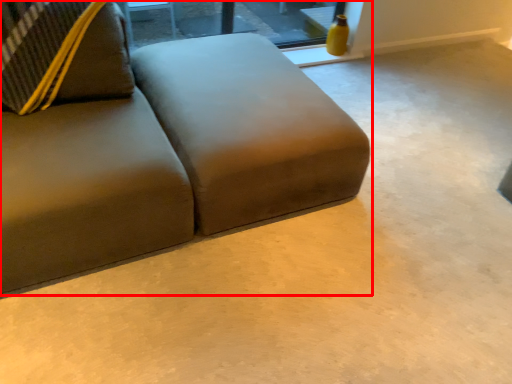
Question: From the image's perspective, what is the correct spatial positioning of studio couch (annotated by the red box) in reference to window?

Choices:
 (A) below
 (B) above

Answer: (A)